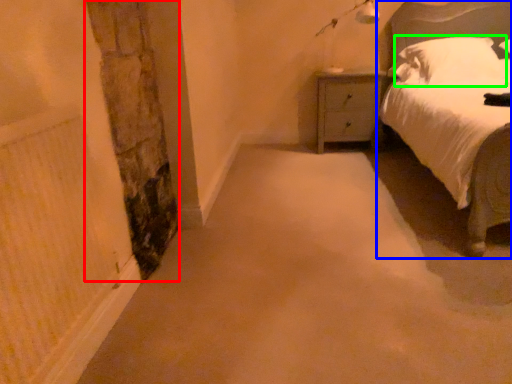
Question: Considering the real-world distances, which object is closest to pillar (highlighted by a red box)? bed (highlighted by a blue box) or pillow (highlighted by a green box).

Choices:
 (A) bed
 (B) pillow

Answer: (A)